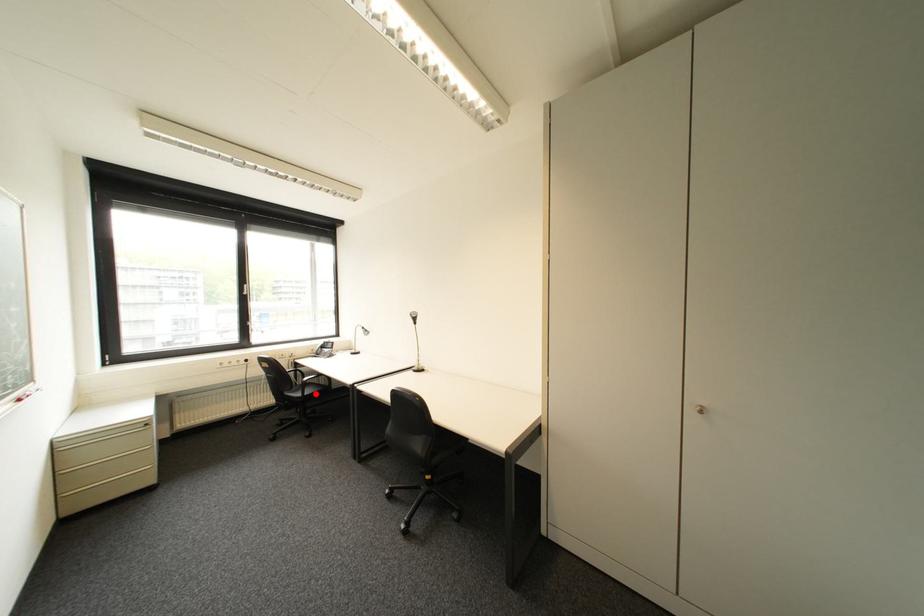
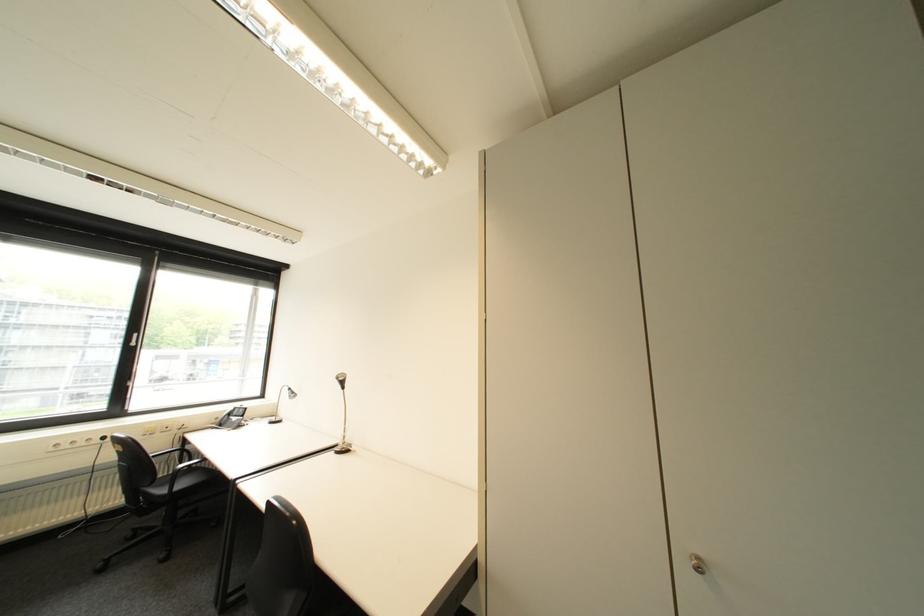
Locate, in the second image, the point that corresponds to the highlighted location in the first image.

(187, 488)